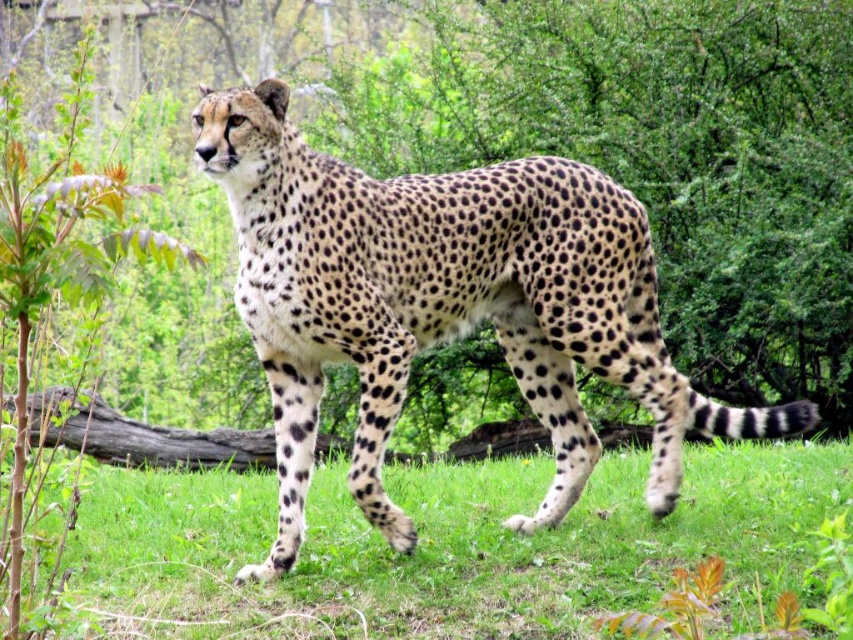
Does point (306, 241) come in front of point (99, 604)?

Yes, point (306, 241) is closer to viewer.

Who is positioned more to the right, spotted fur cheetah at center or green soft grass at lower center?

green soft grass at lower center

Between point (706, 424) and point (433, 548), which one is positioned in front?

Point (706, 424)

At what (x,y) coordinates should I click in order to perform the action: click on spotted fur cheetah at center. Please return your answer as a coordinate pair (x, y). This screenshot has height=640, width=853. Looking at the image, I should click on (444, 304).